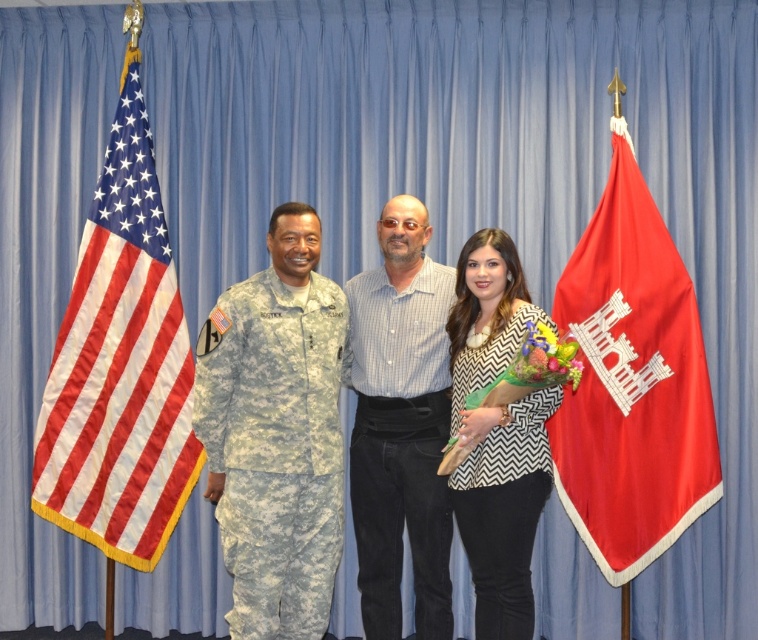
Which is below, red satin flag at right or camouflage uniform at center?

camouflage uniform at center is lower down.

Who is positioned more to the right, red satin flag at right or camouflage uniform at center?

From the viewer's perspective, red satin flag at right appears more on the right side.

Which is behind, point (688, 442) or point (421, 433)?

Point (688, 442)

You are a GUI agent. You are given a task and a screenshot of the screen. Output one action in this format:
    pyautogui.click(x=<x>, y=<y>)
    Task: Click on the red satin flag at right
    
    Given the screenshot: What is the action you would take?
    pyautogui.click(x=631, y=381)

Who is higher up, silky cotton flag at left or camouflage fabric uniform at left?

silky cotton flag at left is higher up.

Does silky cotton flag at left come in front of camouflage fabric uniform at left?

No.

Where is `silky cotton flag at left`? silky cotton flag at left is located at coordinates (121, 365).

Is camouflage fabric uniform at left taller than white zigzag-patterned blouse at center?

Incorrect, camouflage fabric uniform at left's height is not larger of white zigzag-patterned blouse at center's.

Can you confirm if camouflage fabric uniform at left is positioned to the right of white zigzag-patterned blouse at center?

No, camouflage fabric uniform at left is not to the right of white zigzag-patterned blouse at center.

Is point (298, 340) farther from viewer compared to point (520, 616)?

That is False.

Identify the location of camouflage fabric uniform at left. Image resolution: width=758 pixels, height=640 pixels. (274, 449).